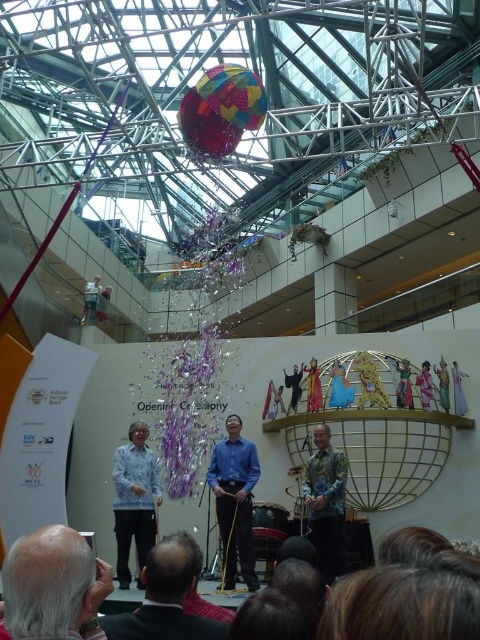
Question: Which point is farther to the camera?

Choices:
 (A) gray hair at lower left
 (B) dark gray suit at lower center

Answer: (B)

Question: Among these objects, which one is nearest to the camera?

Choices:
 (A) blue shirt at center
 (B) blue printed shirt at left
 (C) gray hair at lower left

Answer: (C)

Question: Is blue shirt at center above floral-patterned shirt at center?

Choices:
 (A) no
 (B) yes

Answer: (A)

Question: Which point appears farthest from the camera in this image?

Choices:
 (A) (69, 621)
 (B) (149, 593)
 (C) (230, 532)
 (D) (133, 442)

Answer: (D)

Question: Is gray hair at lower left wider than dark gray suit at lower center?

Choices:
 (A) no
 (B) yes

Answer: (B)

Question: Is blue shirt at center wider than floral-patterned shirt at center?

Choices:
 (A) no
 (B) yes

Answer: (B)